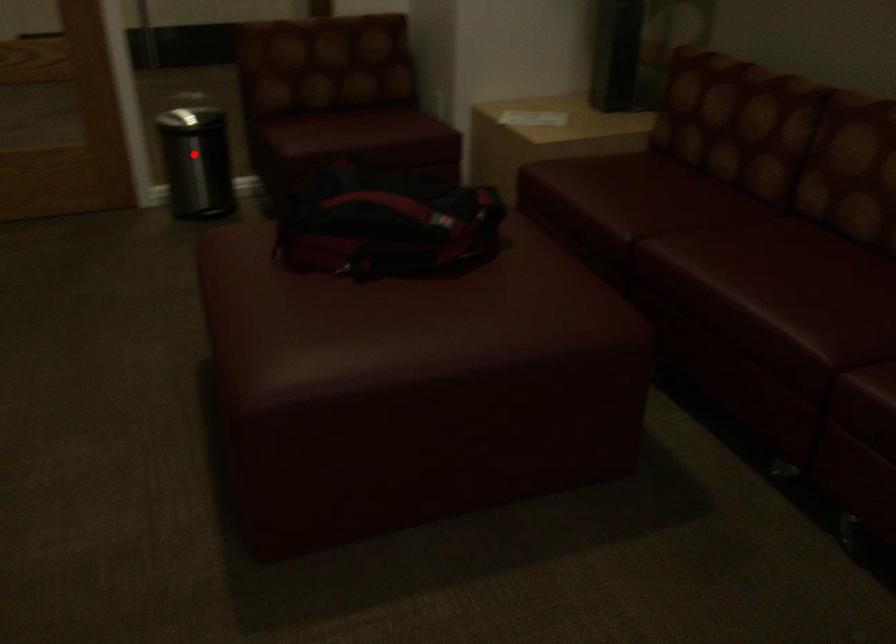
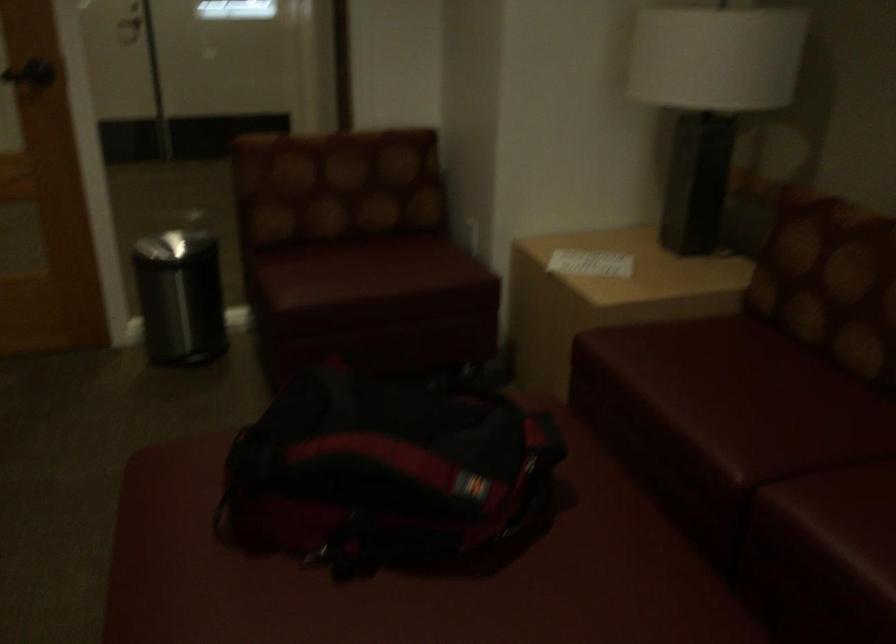
Question: I am providing you with two images of the same scene from different viewpoints. Image1 has a red point marked. In image2, the corresponding 3D location appears at what relative position? Reply with the corresponding letter.

Choices:
 (A) Closer
 (B) Farther

Answer: (A)